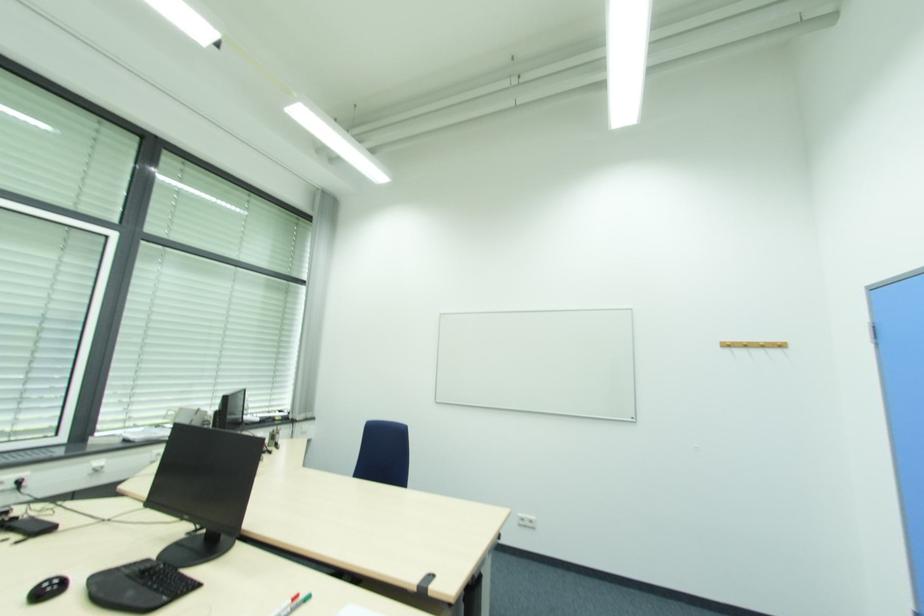
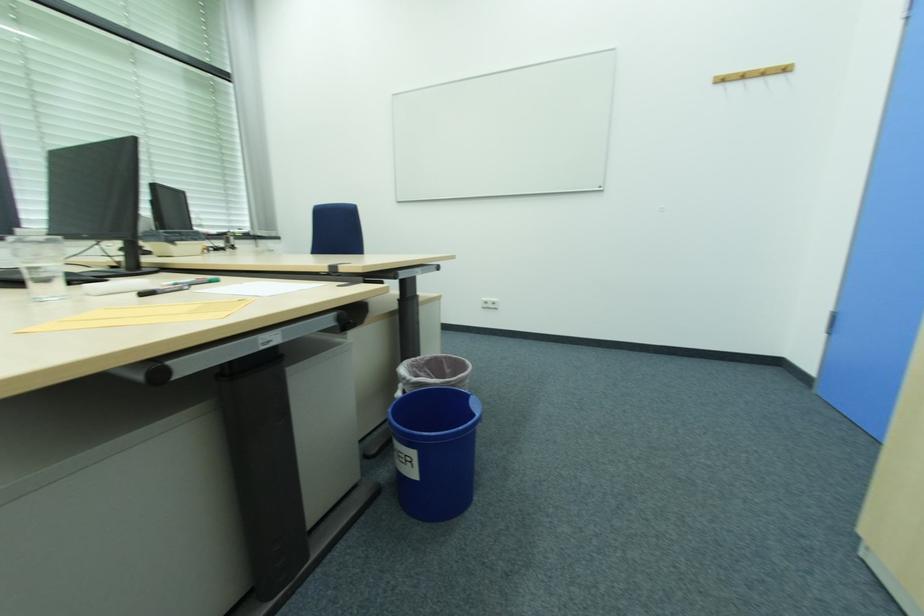
Question: The first image is from the beginning of the video and the second image is from the end. How did the camera likely rotate when shooting the video?

Choices:
 (A) Left
 (B) Right
 (C) Up
 (D) Down

Answer: (D)